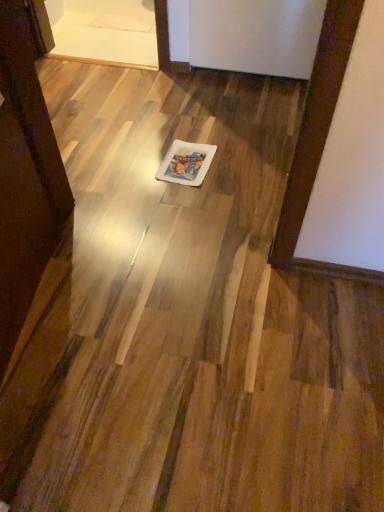
The height and width of the screenshot is (512, 384). I want to click on space that is in front of white glossy square plate at center, so click(193, 210).